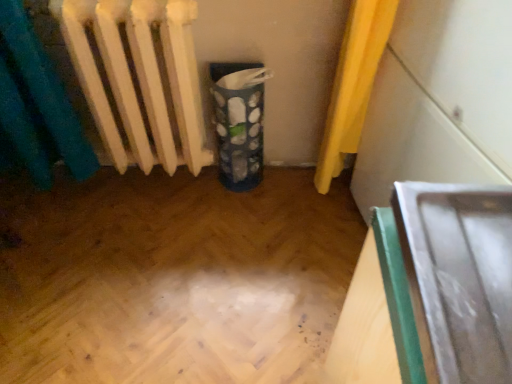
This screenshot has height=384, width=512. I want to click on vacant region under white matte radiator at left (from a real-world perspective), so click(x=157, y=188).